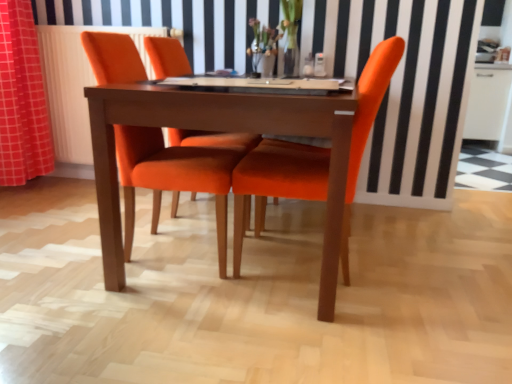
The height and width of the screenshot is (384, 512). I want to click on vacant area that is in front of orange fabric chair at center, positioned as the 1th chair in left-to-right order, so click(144, 321).